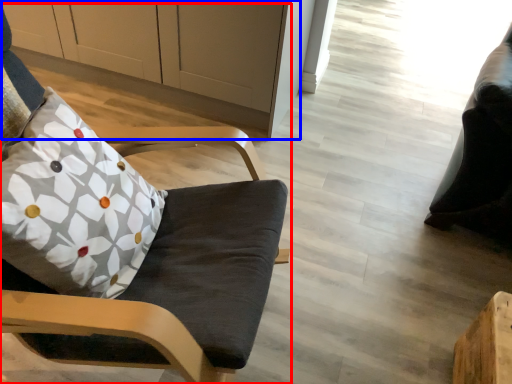
Question: Which object is closer to the camera taking this photo, chair (highlighted by a red box) or cabinetry (highlighted by a blue box)?

Choices:
 (A) chair
 (B) cabinetry

Answer: (A)